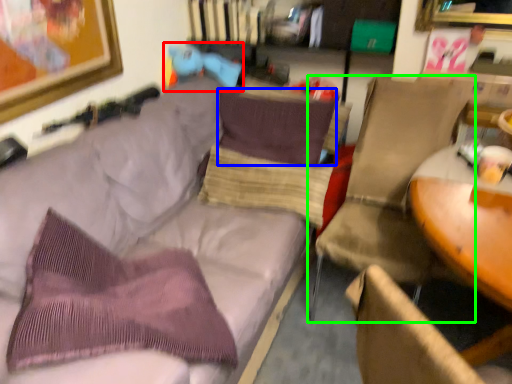
Question: Based on their relative distances, which object is farther from toy (highlighted by a red box)? Choose from pillow (highlighted by a blue box) and chair (highlighted by a green box).

Choices:
 (A) pillow
 (B) chair

Answer: (B)